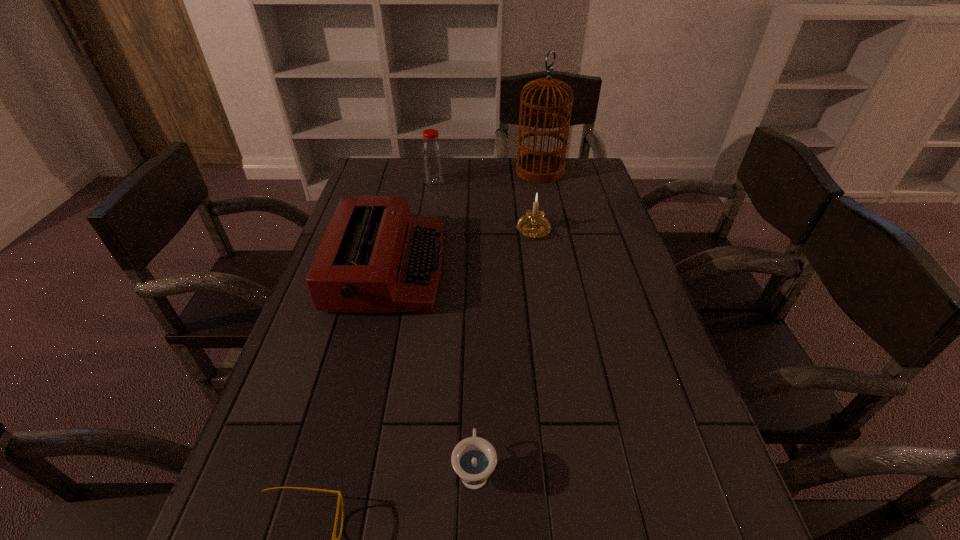
Locate an element on the screen. Image resolution: width=960 pixels, height=540 pixels. free spot that satisfies the following two spatial constraints: 1. on the handle side of the candle holder; 2. on the typing side of the typewriter is located at coordinates (540, 268).

Locate an element on the screen. The width and height of the screenshot is (960, 540). free space in the image that satisfies the following two spatial constraints: 1. on the typing side of the typewriter; 2. on the side of the teacup with the handle is located at coordinates (340, 470).

At what (x,y) coordinates should I click in order to perform the action: click on vacant space that satisfies the following two spatial constraints: 1. on the typing side of the typewriter; 2. on the side of the teacup with the handle. Please return your answer as a coordinate pair (x, y). Looking at the image, I should click on (340, 470).